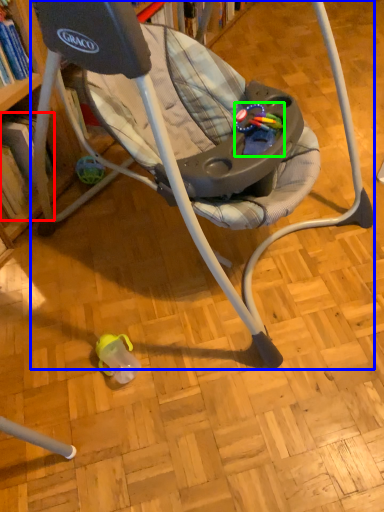
Question: Based on their relative distances, which object is nearer to book (highlighted by a red box)? Choose from chair (highlighted by a blue box) and toy (highlighted by a green box).

Choices:
 (A) chair
 (B) toy

Answer: (A)